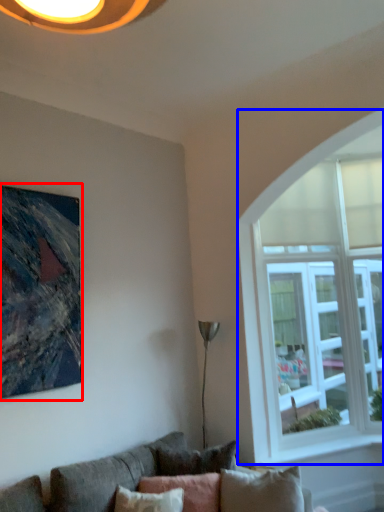
Question: Which object is closer to the camera taking this photo, picture frame (highlighted by a red box) or window (highlighted by a blue box)?

Choices:
 (A) picture frame
 (B) window

Answer: (A)